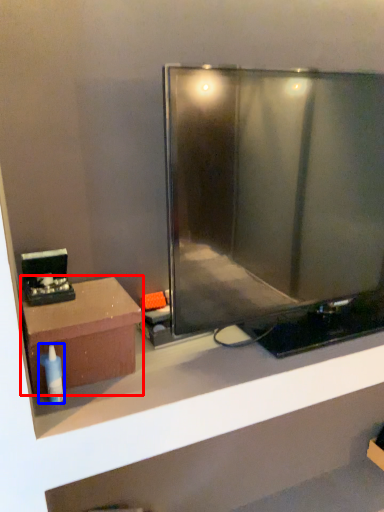
Question: Which object appears closest to the camera in this image, furniture (highlighted by a red box) or toiletry (highlighted by a blue box)?

Choices:
 (A) furniture
 (B) toiletry

Answer: (B)